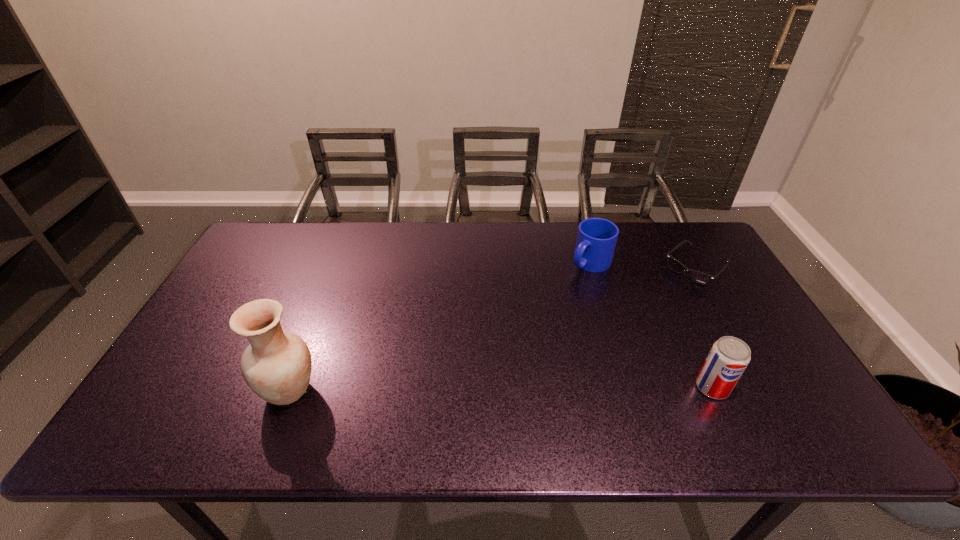
Identify the location of empty space between the leftmost object and the soda. This screenshot has height=540, width=960. (501, 389).

Image resolution: width=960 pixels, height=540 pixels. I want to click on free space between the sunglasses and the soda, so pyautogui.click(x=704, y=328).

At what (x,y) coordinates should I click in order to perform the action: click on free space between the soda and the sunglasses. Please return your answer as a coordinate pair (x, y). This screenshot has width=960, height=540. Looking at the image, I should click on (704, 328).

Where is `vacant region between the soda and the tallest object`? vacant region between the soda and the tallest object is located at coordinates (501, 389).

Locate an element on the screen. Image resolution: width=960 pixels, height=540 pixels. free area in between the shortest object and the third object from right to left is located at coordinates (643, 266).

You are a GUI agent. You are given a task and a screenshot of the screen. Output one action in this format:
    pyautogui.click(x=<x>, y=<y>)
    Task: Click on the vacant area that lies between the third tallest object and the soda
    
    Given the screenshot: What is the action you would take?
    (651, 325)

Find the location of `free spot between the second object from left to right and the soda`. free spot between the second object from left to right and the soda is located at coordinates (651, 325).

Locate which object ranks third in proximity to the shortest object. Please provide its 2D coordinates. Your answer should be formatted as a tuple, i.e. [(x, y)], where the tuple contains the x and y coordinates of a point satisfying the conditions above.

[(277, 365)]

Select which object appears as the second closest to the third object from right to left. Please provide its 2D coordinates. Your answer should be formatted as a tuple, i.e. [(x, y)], where the tuple contains the x and y coordinates of a point satisfying the conditions above.

[(729, 356)]

The width and height of the screenshot is (960, 540). In order to click on vacant space that satisfies the following two spatial constraints: 1. on the back side of the shortest object; 2. on the right side of the leftmost object in this screenshot , I will do `click(336, 269)`.